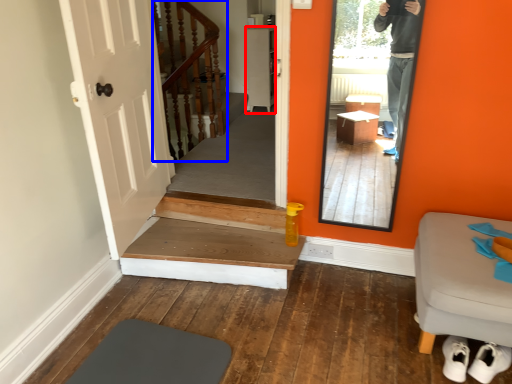
Question: Which point is further to the camera, cabinetry (highlighted by a red box) or stairs (highlighted by a blue box)?

Choices:
 (A) cabinetry
 (B) stairs

Answer: (A)